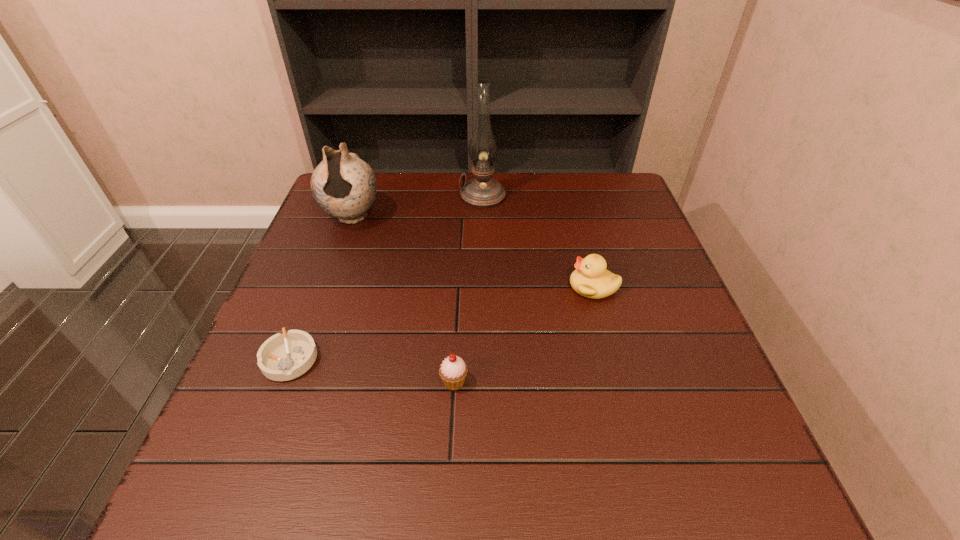
In order to click on vacant space at the near edge of the desktop in this screenshot , I will do tap(363, 475).

The image size is (960, 540). In the image, there is a desktop. Identify the location of free space at the left edge. (313, 269).

Identify the location of vacant position at the right edge of the desktop. The image size is (960, 540). (625, 253).

In the image, there is a desktop. What are the coordinates of `free space at the near right corner` in the screenshot? It's located at (751, 484).

Locate an element on the screen. vacant region between the ashtray and the tallest object is located at coordinates (386, 278).

Locate an element on the screen. The height and width of the screenshot is (540, 960). free spot between the cupcake and the oil lamp is located at coordinates (468, 289).

Where is `free point between the cupcake and the ashtray`? free point between the cupcake and the ashtray is located at coordinates (372, 370).

The image size is (960, 540). What are the coordinates of `empty location between the tallest object and the rightmost object` in the screenshot? It's located at (538, 241).

Identify the location of free space between the cupcake and the shortest object. (372, 370).

What are the coordinates of `vacant region between the oil lamp and the cupcake` in the screenshot? It's located at (468, 289).